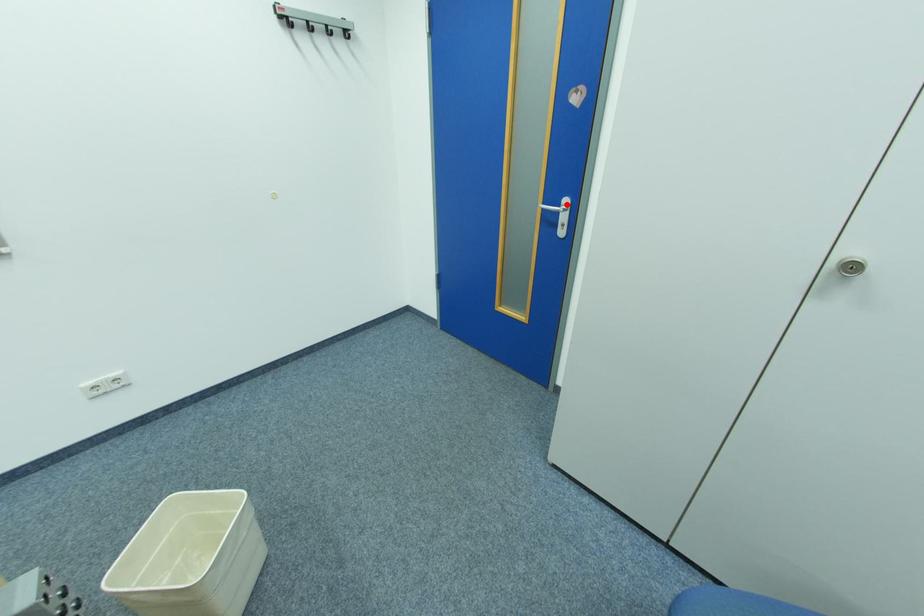
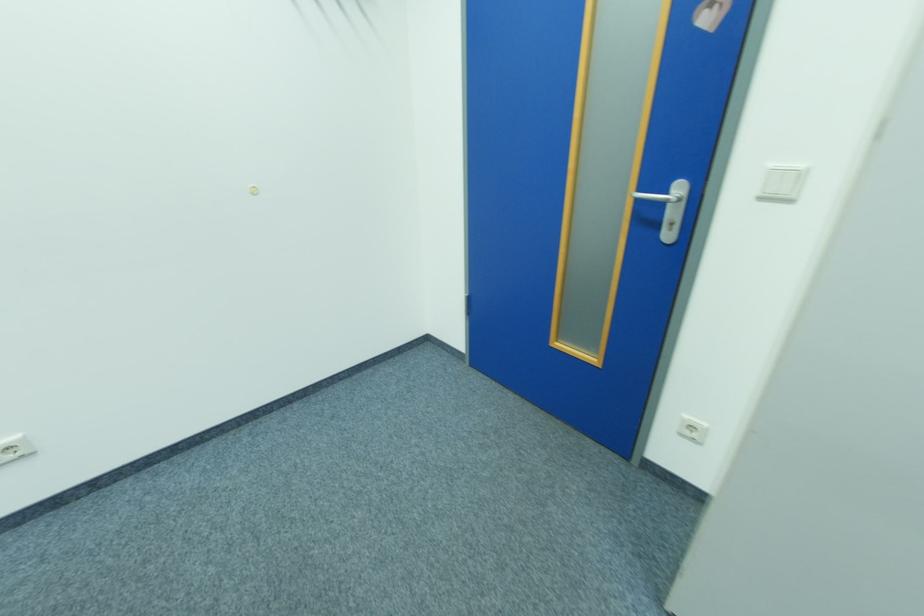
In the second image, find the point that corresponds to the highlighted location in the first image.

(677, 195)